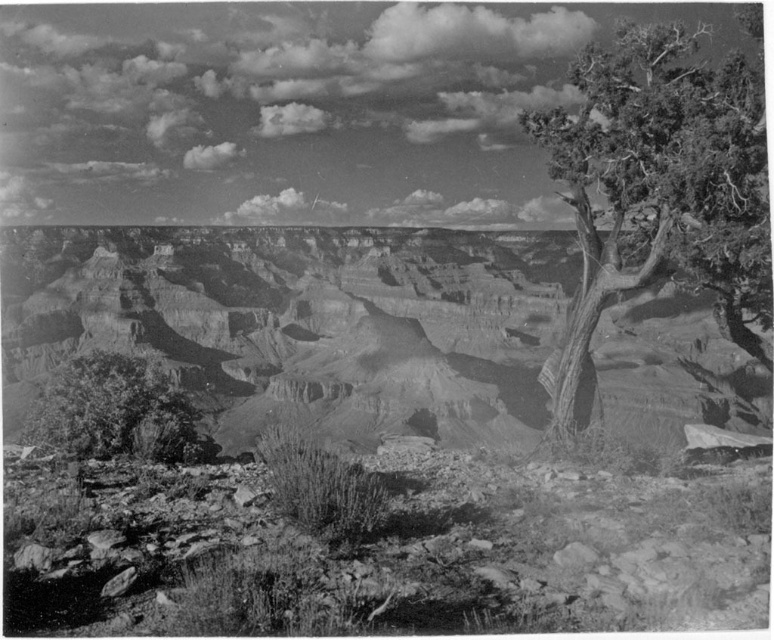
You are a hiker standing at the edge of the rugged rock canyon at center. You want to throw a pebble into the canyon. Considering the distance, will the pebble reach the bottom before hitting the side walls?

The rugged rock canyon at center is 45.32 meters away from the viewer. Assuming typical throwing strength, the pebble would likely hit the side walls before reaching the bottom due to the canyon depth and the limitations of human throwing distance.

Consider the image. You are a hiker standing at the edge of the rugged rock canyon at center and looking towards the green textured tree at right. Which object is closer to you?

The rugged rock canyon at center is closer to you than the green textured tree at right because it is positioned further away in the background.

You are a photographer standing at the edge of the Grand Canyon, holding a camera. You want to capture the green textured tree at right in your shot. Based on the coordinates provided, where should you position your camera to ensure the tree is centered in the frame?

The green textured tree at right is located at coordinates point (661, 186). To center it in your frame, position your camera so that the crosshairs align with those coordinates.